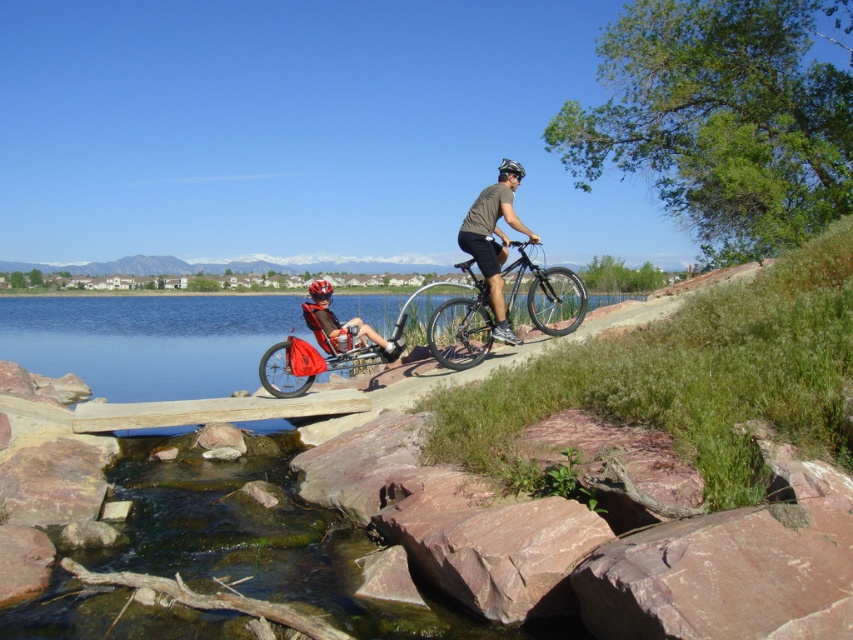
Which is below, matte red bicycle at center or red matte bicycle helmet at center?

Positioned lower is matte red bicycle at center.

Is matte red bicycle at center positioned at the back of red matte bicycle helmet at center?

No, matte red bicycle at center is in front of red matte bicycle helmet at center.

Is point (325, 337) positioned behind point (318, 298)?

That is False.

Image resolution: width=853 pixels, height=640 pixels. Identify the location of matte red bicycle at center. (340, 324).

Which is more to the left, red matte bicycle helmet at center or black matte bicycle helmet at upper center?

red matte bicycle helmet at center

Which is behind, point (331, 291) or point (502, 163)?

Point (331, 291)

Who is more forward, (309, 291) or (509, 166)?

Point (509, 166) is in front.

Where is `red matte bicycle helmet at center`? This screenshot has width=853, height=640. red matte bicycle helmet at center is located at coordinates (320, 289).

Does matte red bicycle at center have a lesser height compared to black matte bicycle helmet at upper center?

Indeed, matte red bicycle at center has a lesser height compared to black matte bicycle helmet at upper center.

Looking at this image, who is more distant from viewer, [358,321] or [519,163]?

The point [519,163] is behind.

Locate an element on the screen. The image size is (853, 640). matte red bicycle at center is located at coordinates (340, 324).